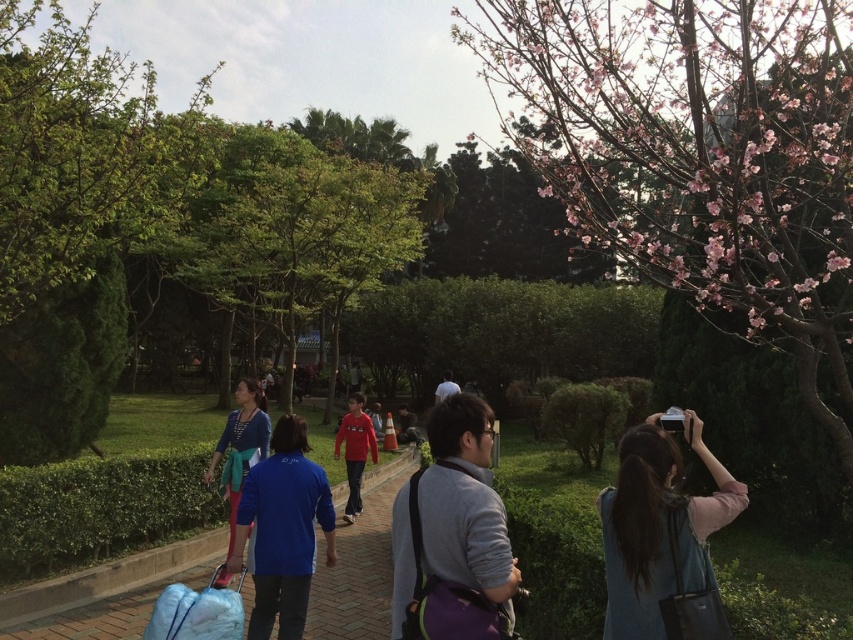
Between pink blossoms at upper right and blue fabric jacket at center, which one appears on the left side from the viewer's perspective?

From the viewer's perspective, blue fabric jacket at center appears more on the left side.

Is point (515, 13) closer to viewer compared to point (270, 534)?

That is False.

Locate an element on the screen. This screenshot has height=640, width=853. pink blossoms at upper right is located at coordinates (693, 141).

Can you confirm if pink fabric at center is taller than blue fabric bag at center?

In fact, pink fabric at center may be shorter than blue fabric bag at center.

What do you see at coordinates (663, 538) in the screenshot? This screenshot has height=640, width=853. I see `pink fabric at center` at bounding box center [663, 538].

You are a GUI agent. You are given a task and a screenshot of the screen. Output one action in this format:
    pyautogui.click(x=<x>, y=<y>)
    Task: Click on the pink fabric at center
    This screenshot has width=853, height=640.
    Given the screenshot: What is the action you would take?
    pyautogui.click(x=663, y=538)

Who is taller, blue fabric jacket at center or blue fabric bag at center?

blue fabric bag at center is taller.

At what (x,y) coordinates should I click in order to perform the action: click on blue fabric jacket at center. Please return your answer as a coordinate pair (x, y). This screenshot has height=640, width=853. Looking at the image, I should click on (282, 531).

Is point (277, 512) in front of point (227, 484)?

Yes, point (277, 512) is closer to viewer.

You are a GUI agent. You are given a task and a screenshot of the screen. Output one action in this format:
    pyautogui.click(x=<x>, y=<y>)
    Task: Click on the blue fabric jacket at center
    The image size is (853, 640).
    Given the screenshot: What is the action you would take?
    pyautogui.click(x=282, y=531)